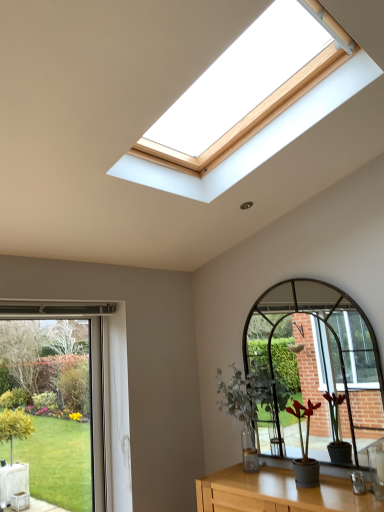
Question: Can we say wooden table at lower center lies outside green matte plant at center, which is the first houseplant in front-to-back order?

Choices:
 (A) no
 (B) yes

Answer: (B)

Question: From the image's perspective, is wooden table at lower center on top of green matte plant at center, the second houseplant positioned from the back?

Choices:
 (A) no
 (B) yes

Answer: (A)

Question: Is the depth of wooden table at lower center less than that of green matte plant at center, which is counted as the 1th houseplant, starting from the right?

Choices:
 (A) no
 (B) yes

Answer: (B)

Question: From a real-world perspective, is wooden table at lower center positioned over green matte plant at center, which is counted as the 1th houseplant, starting from the right, based on gravity?

Choices:
 (A) no
 (B) yes

Answer: (A)

Question: Does wooden table at lower center have a smaller size compared to green matte plant at center, the 2th houseplant in the left-to-right sequence?

Choices:
 (A) yes
 (B) no

Answer: (B)

Question: From the image's perspective, is wooden table at lower center beneath green matte plant at center, which is counted as the 1th houseplant, starting from the right?

Choices:
 (A) yes
 (B) no

Answer: (A)

Question: Is green matte plant at center, the 2th houseplant in the left-to-right sequence, behind green glass window at lower left?

Choices:
 (A) no
 (B) yes

Answer: (A)

Question: Is green matte plant at center, the second houseplant positioned from the back, smaller than green glass window at lower left?

Choices:
 (A) yes
 (B) no

Answer: (A)

Question: Considering the relative sizes of green matte plant at center, which is counted as the 1th houseplant, starting from the right, and green glass window at lower left in the image provided, is green matte plant at center, which is counted as the 1th houseplant, starting from the right, shorter than green glass window at lower left?

Choices:
 (A) no
 (B) yes

Answer: (B)

Question: Considering the relative sizes of green matte plant at center, which is the first houseplant in front-to-back order, and green glass window at lower left in the image provided, is green matte plant at center, which is the first houseplant in front-to-back order, wider than green glass window at lower left?

Choices:
 (A) yes
 (B) no

Answer: (A)

Question: Is green matte plant at center, the 2th houseplant in the left-to-right sequence, placed right next to green glass window at lower left?

Choices:
 (A) no
 (B) yes

Answer: (A)

Question: Is green glass window at lower left located within green matte plant at center, the 2th houseplant in the left-to-right sequence?

Choices:
 (A) yes
 (B) no

Answer: (B)

Question: Does green matte plant at center, marked as the 2th houseplant in a front-to-back arrangement, have a lesser width compared to green glass window at lower left?

Choices:
 (A) no
 (B) yes

Answer: (A)